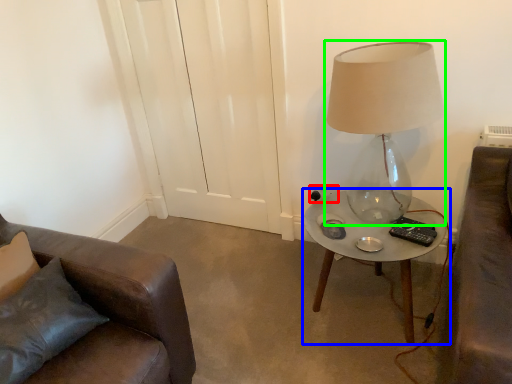
Question: Which is farther away from electric outlet (highlighted by a red box)? table (highlighted by a blue box) or lamp (highlighted by a green box)?

Choices:
 (A) table
 (B) lamp

Answer: (B)